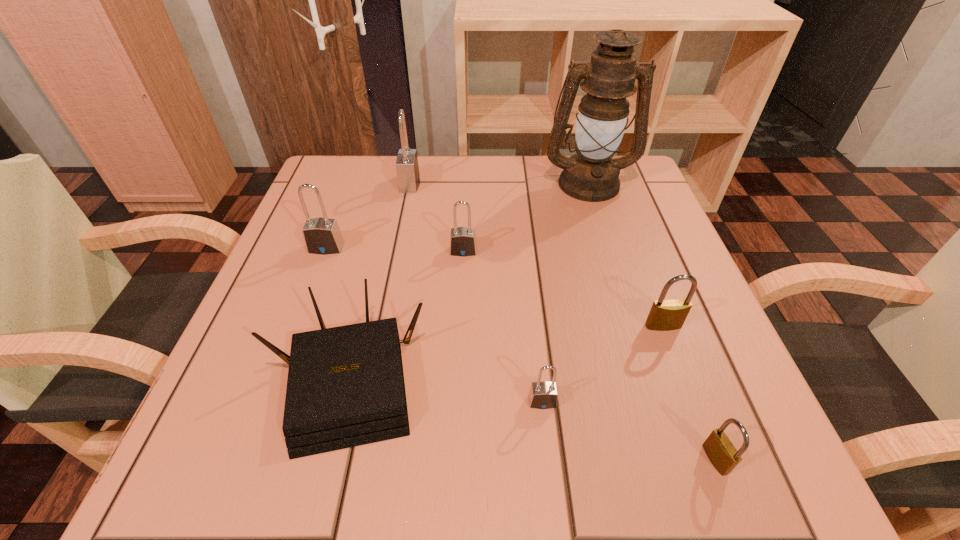
Where is `the tallest object`? the tallest object is located at coordinates (591, 175).

Identify the location of the farthest padlock. This screenshot has width=960, height=540. (407, 167).

Locate an element on the screen. The width and height of the screenshot is (960, 540). the second gray padlock from left to right is located at coordinates (407, 167).

Where is `the leftmost padlock`? The width and height of the screenshot is (960, 540). the leftmost padlock is located at coordinates (322, 236).

Identify the location of the sixth shortest object. The height and width of the screenshot is (540, 960). (322, 236).

The width and height of the screenshot is (960, 540). I want to click on the fourth object from left to right, so click(x=462, y=239).

Where is `the third padlock from left to right`? The width and height of the screenshot is (960, 540). the third padlock from left to right is located at coordinates (462, 239).

Identify the location of the bigger brass padlock. The height and width of the screenshot is (540, 960). (670, 314).

The image size is (960, 540). In order to click on the third nearest padlock in this screenshot , I will do `click(670, 314)`.

Locate an element on the screen. The height and width of the screenshot is (540, 960). router is located at coordinates (345, 388).